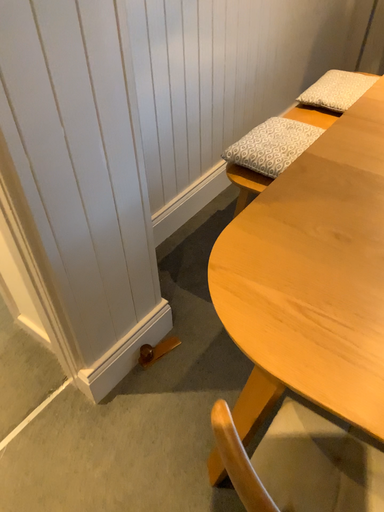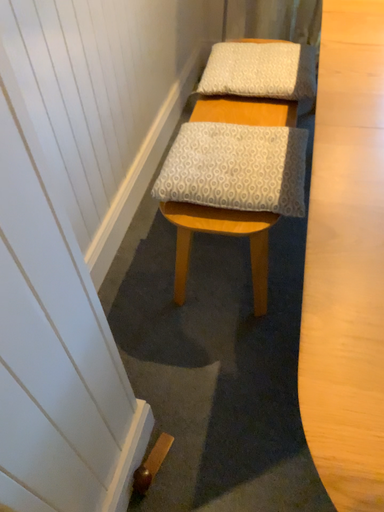
Question: How did the camera likely rotate when shooting the video?

Choices:
 (A) rotated right
 (B) rotated left

Answer: (A)